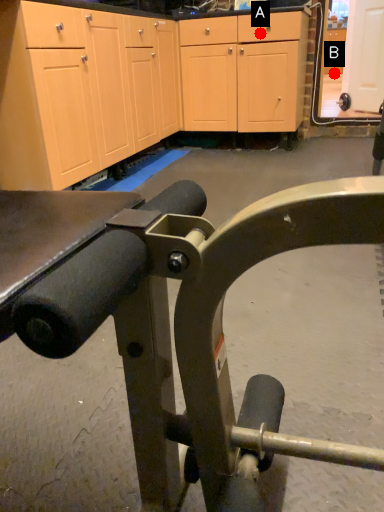
Question: Two points are circled on the image, labeled by A and B beside each circle. Which point is farther from the camera taking this photo?

Choices:
 (A) A is further
 (B) B is further

Answer: (B)